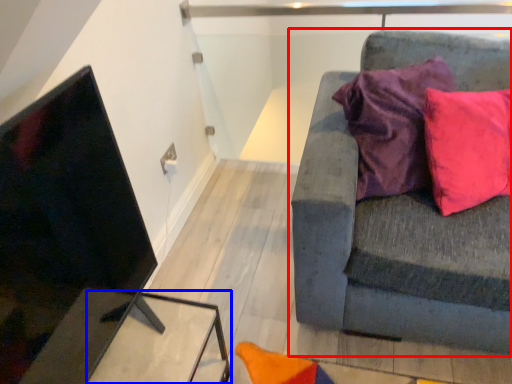
Question: Among these objects, which one is nearest to the camera, studio couch (highlighted by a red box) or table (highlighted by a blue box)?

Choices:
 (A) studio couch
 (B) table

Answer: (A)